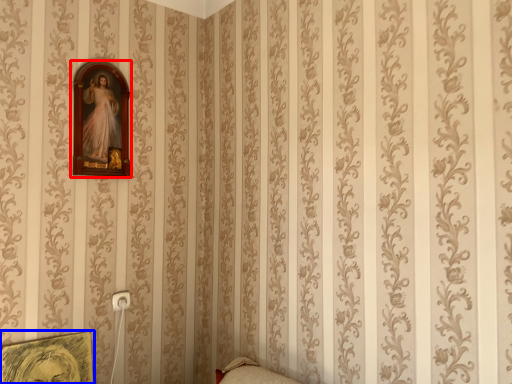
Question: Which of the following is the closest to the observer, picture frame (highlighted by a red box) or picture frame (highlighted by a blue box)?

Choices:
 (A) picture frame
 (B) picture frame

Answer: (B)